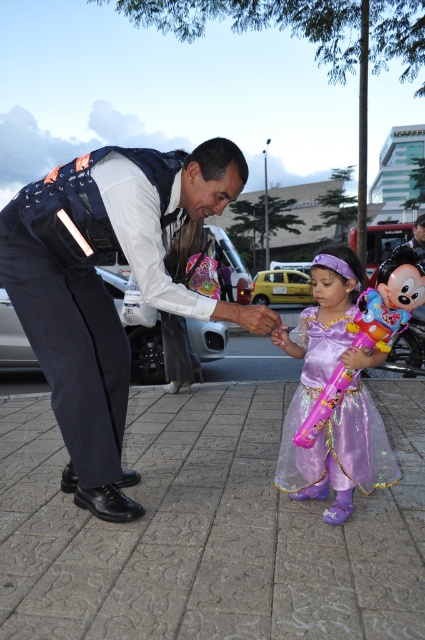
Which is above, purple iridescent dress at center or shiny plastic balloon at center?

shiny plastic balloon at center

Who is lower down, purple iridescent dress at center or shiny plastic balloon at center?

purple iridescent dress at center is below.

Is point (312, 364) more distant than point (319, 426)?

That is True.

Locate an element on the screen. This screenshot has width=425, height=640. purple iridescent dress at center is located at coordinates (333, 419).

From the picture: Who is shorter, dark blue uniform at left or purple iridescent dress at center?

With less height is purple iridescent dress at center.

Looking at this image, can you confirm if dark blue uniform at left is smaller than purple iridescent dress at center?

Actually, dark blue uniform at left might be larger than purple iridescent dress at center.

Who is more distant from viewer, (x=37, y=273) or (x=382, y=452)?

Point (x=382, y=452)

You are a GUI agent. You are given a task and a screenshot of the screen. Output one action in this format:
    pyautogui.click(x=<x>, y=<y>)
    Task: Click on the dark blue uniform at left
    The image size is (425, 640).
    Given the screenshot: What is the action you would take?
    (x=105, y=291)

Does dark blue uniform at left lie in front of shiny plastic balloon at center?

Yes, dark blue uniform at left is in front of shiny plastic balloon at center.

Is dark blue uniform at left bigger than shiny plastic balloon at center?

No, dark blue uniform at left is not bigger than shiny plastic balloon at center.

Is point (197, 184) in front of point (404, 278)?

No, (197, 184) is further to viewer.

Locate an element on the screen. The height and width of the screenshot is (640, 425). dark blue uniform at left is located at coordinates (105, 291).